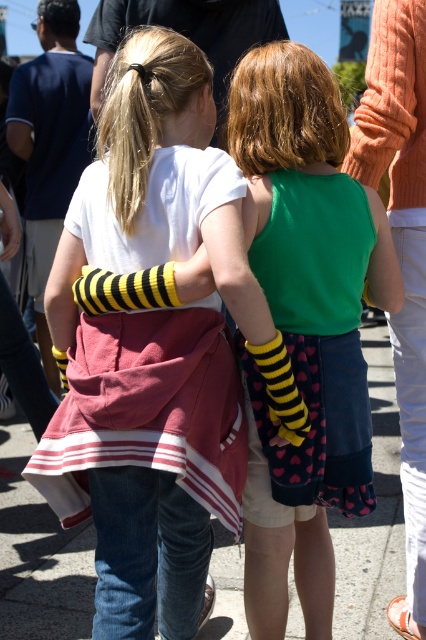
You are a photographer trying to capture both the white cotton shirt at center and the green fabric dress at center in a single shot. Which one should you focus on first to ensure both are in focus?

You should focus on the white cotton shirt at center first because it is closer to the viewer than the green fabric dress at center, so by focusing on the closer object, the farther one will also be in focus.

You are a photographer trying to capture both the white cotton shirt at center and the green fabric dress at center in a single frame. Since you want to ensure both are visible, which clothing item should you focus on first to make sure it fits into the frame?

The white cotton shirt at center is bigger than the green fabric dress at center, so you should focus on positioning the white cotton shirt at center first to ensure it fits into the frame, then adjust to include the smaller green fabric dress at center.

You are a photographer trying to capture a candid shot of the two girls in the scene. You notice a white cotton shirt at center located at point (x=158, y=346). If you position your camera to focus on the girl on the left, will the white cotton shirt at center be in the background or foreground of your shot?

The white cotton shirt at center is located at point (x=158, y=346). Since the girls are positioned in front of the background elements, the white cotton shirt at center would be in the foreground of the shot if it is closer to the camera than the girls. However, without specific depth information, we can infer based on typical compositions that the girls are the main subjects and thus the white cotton shirt at center is likely part of the background.